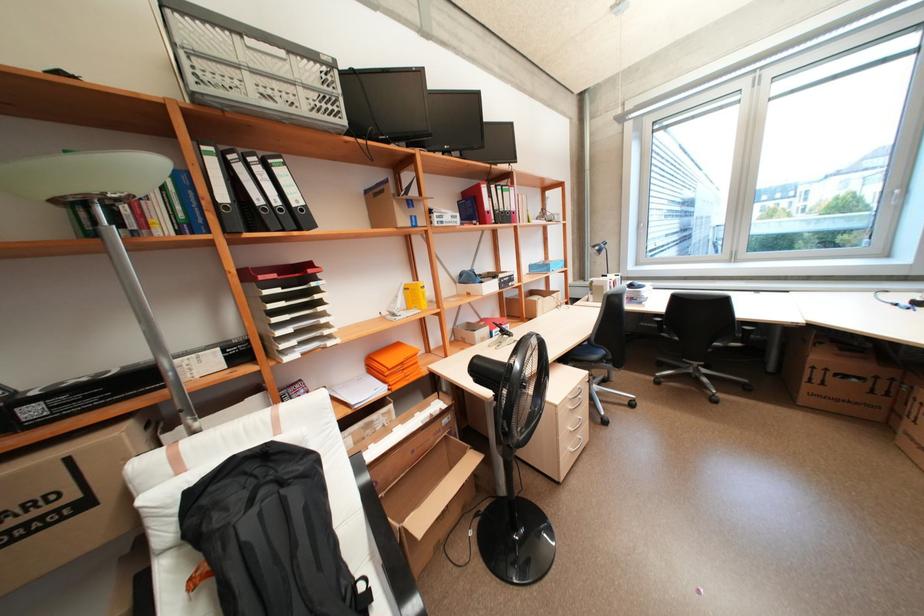
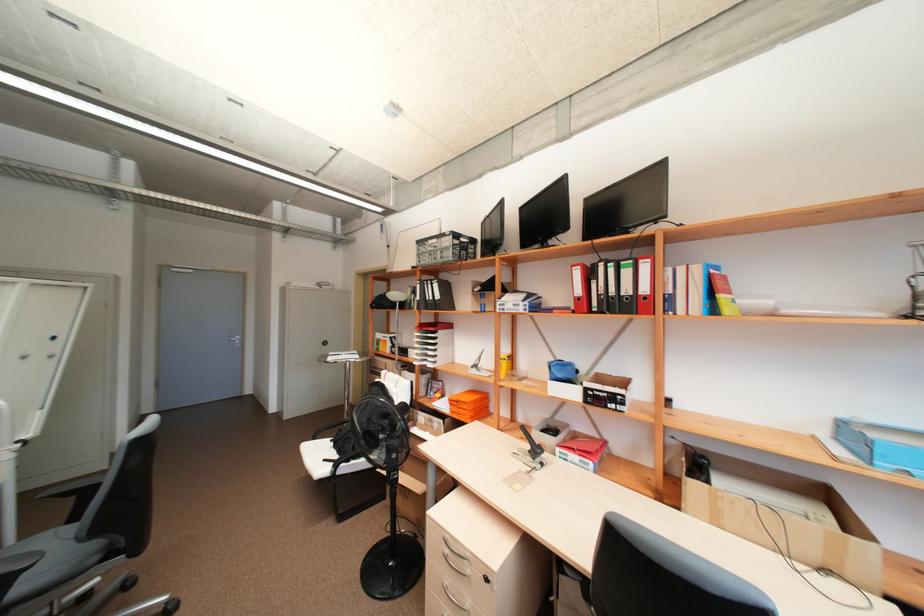
Where in the second image is the point corresponding to (x=407, y=363) from the first image?

(463, 400)